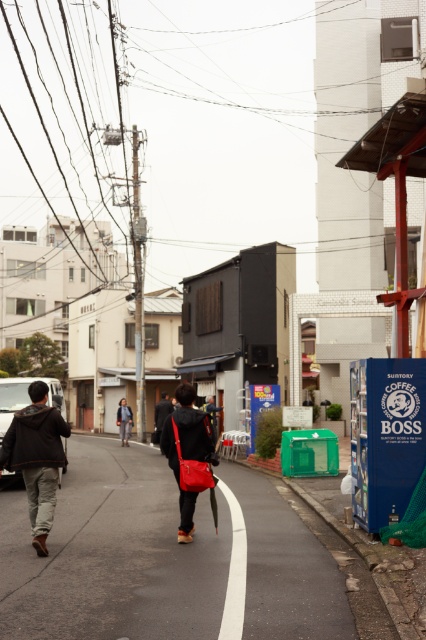
You are a delivery person who needs to pick up a package. You see a matte red bag at center and a dark brown leather jacket at center. Which item is closer to you?

The matte red bag at center is closer to the viewer than the dark brown leather jacket at center.